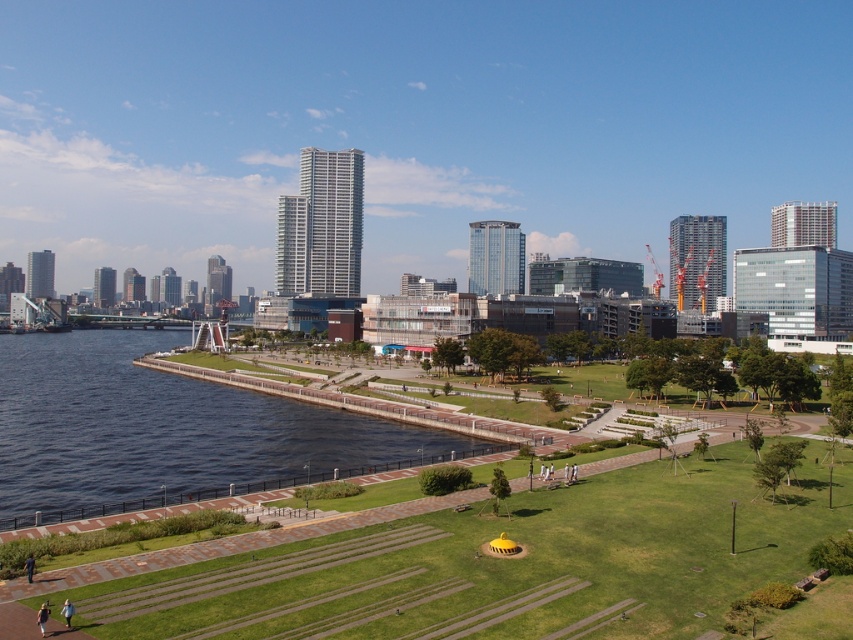
Who is positioned more to the right, green grass at lower center or blue glassy water at lower left?

From the viewer's perspective, green grass at lower center appears more on the right side.

Is green grass at lower center closer to camera compared to blue glassy water at lower left?

Yes.

The height and width of the screenshot is (640, 853). What do you see at coordinates (505, 566) in the screenshot?
I see `green grass at lower center` at bounding box center [505, 566].

Where is `green grass at lower center`? Image resolution: width=853 pixels, height=640 pixels. green grass at lower center is located at coordinates pos(505,566).